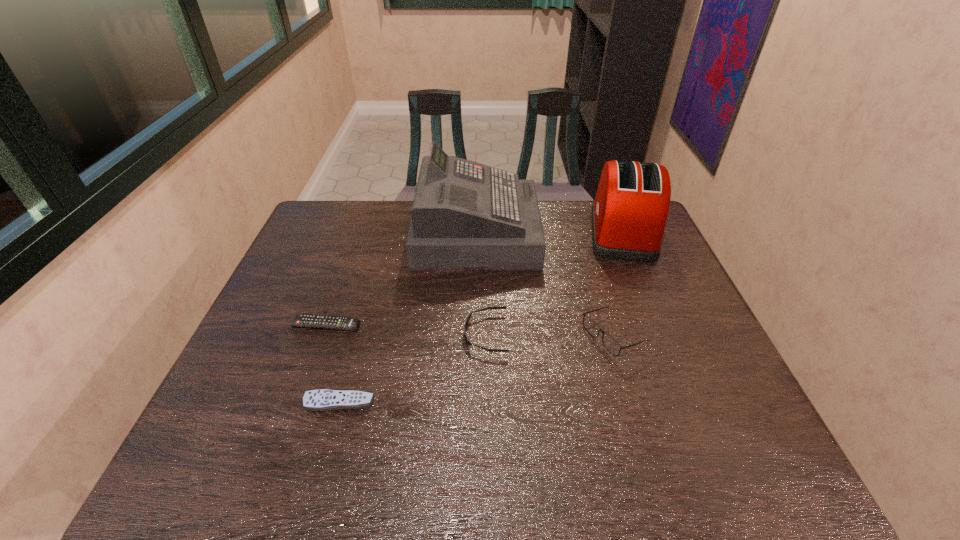
Identify the location of vacant space situated with the lenses facing outward on the fourth shortest object. (537, 336).

Where is `vacant space located on the front-facing side of the sunglasses`? vacant space located on the front-facing side of the sunglasses is located at coordinates (316, 334).

What are the coordinates of `vacant area situated 0.140m on the front-facing side of the sunglasses` in the screenshot? It's located at pos(409,334).

Where is `blank space located 0.060m on the front-facing side of the sunglasses`? The height and width of the screenshot is (540, 960). blank space located 0.060m on the front-facing side of the sunglasses is located at coordinates (441, 334).

At what (x,y) coordinates should I click in order to perform the action: click on free location located 0.210m on the back of the farther remote control. Please return your answer as a coordinate pair (x, y). This screenshot has height=540, width=960. Looking at the image, I should click on (347, 267).

Where is `vacant point located on the right of the nearer remote control`? This screenshot has width=960, height=540. vacant point located on the right of the nearer remote control is located at coordinates (455, 402).

This screenshot has height=540, width=960. I want to click on cash register that is at the far edge, so click(x=465, y=215).

This screenshot has width=960, height=540. I want to click on toaster located in the far edge section of the desktop, so click(x=629, y=213).

This screenshot has height=540, width=960. I want to click on object positioned at the left edge, so click(x=301, y=320).

What are the coordinates of `object located at the right edge` in the screenshot? It's located at (629, 213).